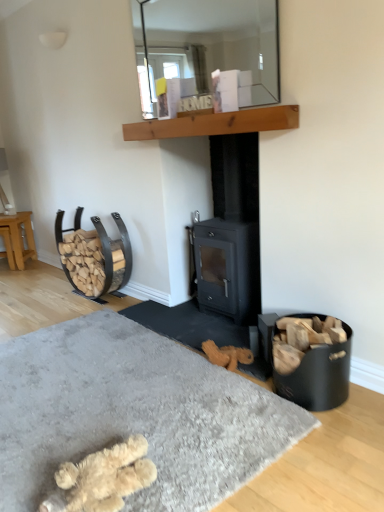
Identify the location of free space to the right of fuzzy beige slippers at lower left. The height and width of the screenshot is (512, 384). coord(205,466).